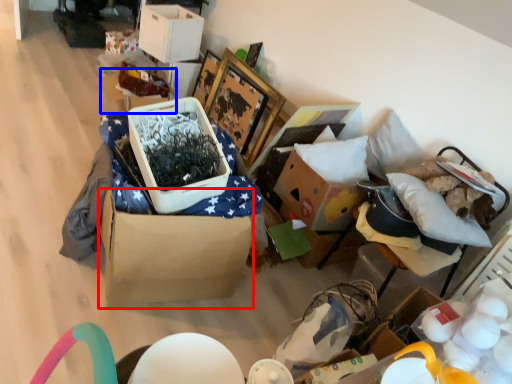
Question: Which object appears farthest to the camera in this image, cardboard box (highlighted by a red box) or storage box (highlighted by a blue box)?

Choices:
 (A) cardboard box
 (B) storage box

Answer: (B)